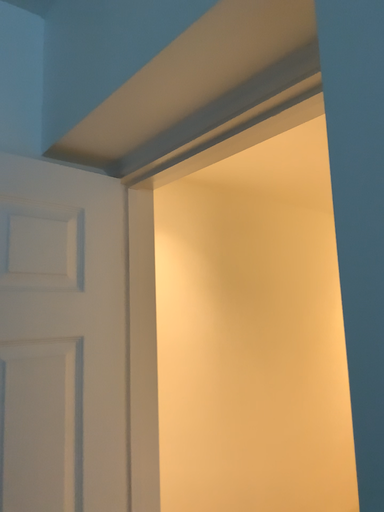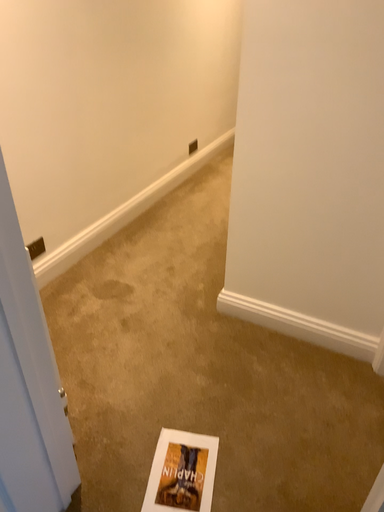
Question: How did the camera likely rotate when shooting the video?

Choices:
 (A) rotated right
 (B) rotated left

Answer: (A)